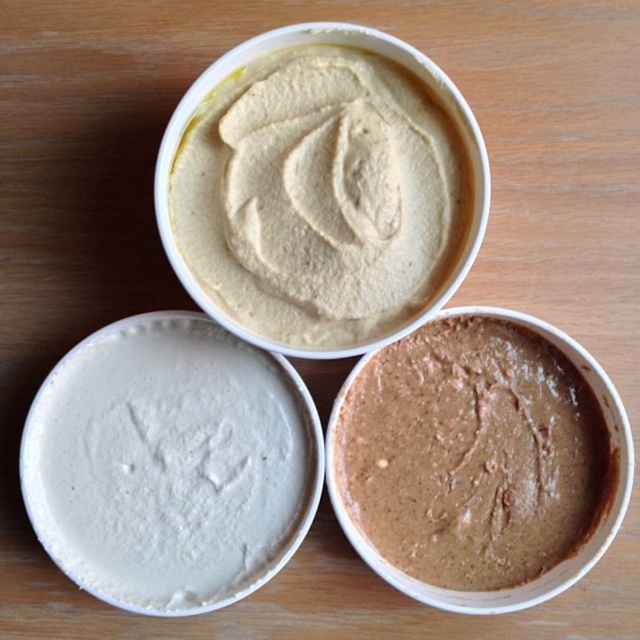
Question: Can you confirm if brown matte hummus at bottom right is positioned below smooth beige pudding at upper center?

Choices:
 (A) no
 (B) yes

Answer: (B)

Question: Where is white matte frosting at center located in relation to brown matte hummus at bottom right in the image?

Choices:
 (A) right
 (B) left

Answer: (B)

Question: Which point is closer to the camera taking this photo?

Choices:
 (A) (524, 477)
 (B) (70, 476)

Answer: (B)

Question: Can you confirm if brown matte hummus at bottom right is positioned to the left of smooth beige pudding at upper center?

Choices:
 (A) yes
 (B) no

Answer: (B)

Question: Among these objects, which one is nearest to the camera?

Choices:
 (A) white matte frosting at center
 (B) brown matte hummus at bottom right
 (C) smooth beige pudding at upper center

Answer: (C)

Question: Which of the following is the closest to the observer?

Choices:
 (A) brown matte hummus at bottom right
 (B) white matte frosting at center

Answer: (B)